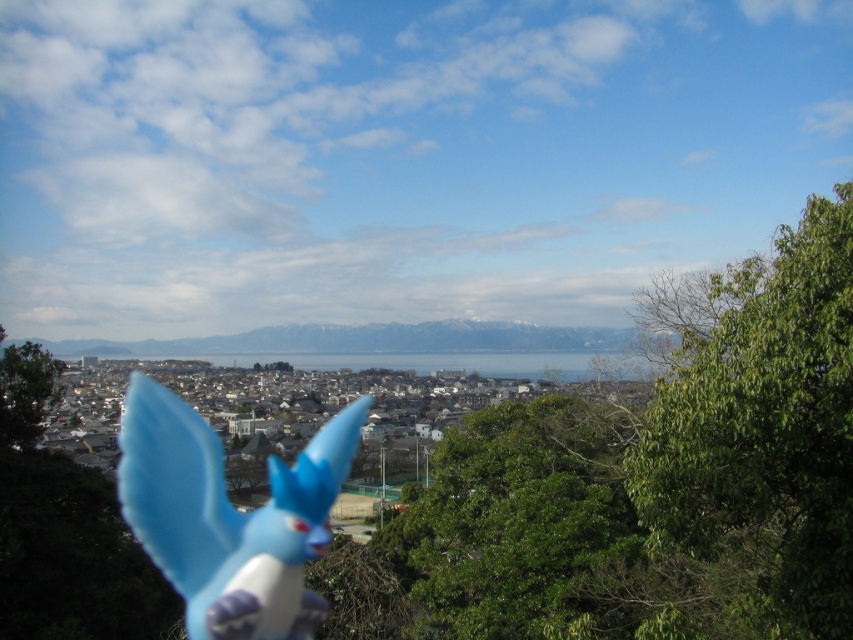
You are a photographer setting up a tripod to capture the scene described. You notice the matte plastic toy at center and the green matte tree at lower left. Which object is positioned lower in the frame?

The matte plastic toy at center is positioned below the green matte tree at lower left, so it is lower in the frame.

You are taking a photo of the urban landscape from an elevated vantage point. There is a matte plastic toy at center in the foreground. To ensure the toy is in sharp focus while the background remains slightly blurred, where should you adjust the focus point on your camera? Please provide the coordinates in the format X,Y between 0 and 1.

The focus point should be set at (229,516) to ensure the matte plastic toy at center is in sharp focus while keeping the background blurred.

You are standing at the vantage point looking at the green leafy tree at right and the matte plastic toy at center. Which object would appear larger in your field of view?

The green leafy tree at right appears larger in your field of view because it is closer to the viewer than the matte plastic toy at center.